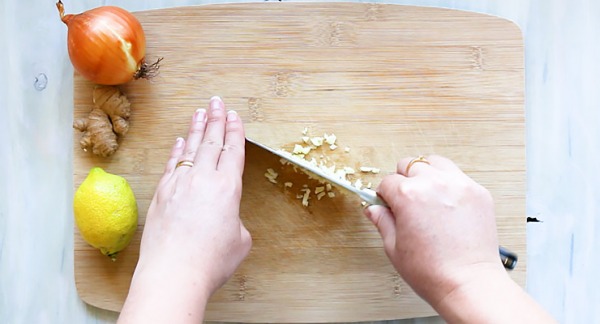
The height and width of the screenshot is (324, 600). Find the location of `dark streaks in table`. dark streaks in table is located at coordinates (24, 14), (64, 95), (548, 71), (570, 245), (565, 153).